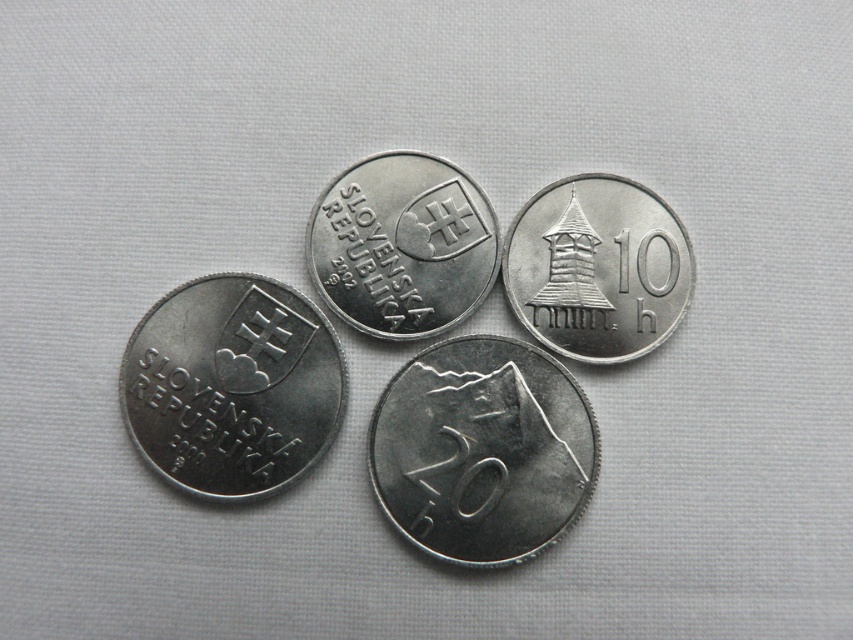
Looking at this image, does silver metallic mountain at center have a greater width compared to silver metallic coin at lower left?

Yes.

Which is above, silver metallic mountain at center or silver metallic coin at lower left?

Positioned higher is silver metallic coin at lower left.

Measure the distance between point (439, 468) and camera.

The distance of point (439, 468) from camera is 1.31 meters.

What are the coordinates of `silver metallic mountain at center` in the screenshot? It's located at (482, 451).

Is silver metallic coin at lower left bigger than silver metallic tower at upper right?

Indeed, silver metallic coin at lower left has a larger size compared to silver metallic tower at upper right.

Who is more forward, (x=311, y=461) or (x=627, y=336)?

Positioned in front is point (x=311, y=461).

Identify the location of silver metallic coin at lower left. The image size is (853, 640). (231, 385).

Who is higher up, silver metallic mountain at center or silver metallic tower at upper right?

Positioned higher is silver metallic tower at upper right.

Does silver metallic mountain at center appear under silver metallic tower at upper right?

Correct, silver metallic mountain at center is located below silver metallic tower at upper right.

At what (x,y) coordinates should I click in order to perform the action: click on silver metallic mountain at center. Please return your answer as a coordinate pair (x, y). This screenshot has height=640, width=853. Looking at the image, I should click on (482, 451).

Locate an element on the screen. The width and height of the screenshot is (853, 640). silver metallic mountain at center is located at coordinates (482, 451).